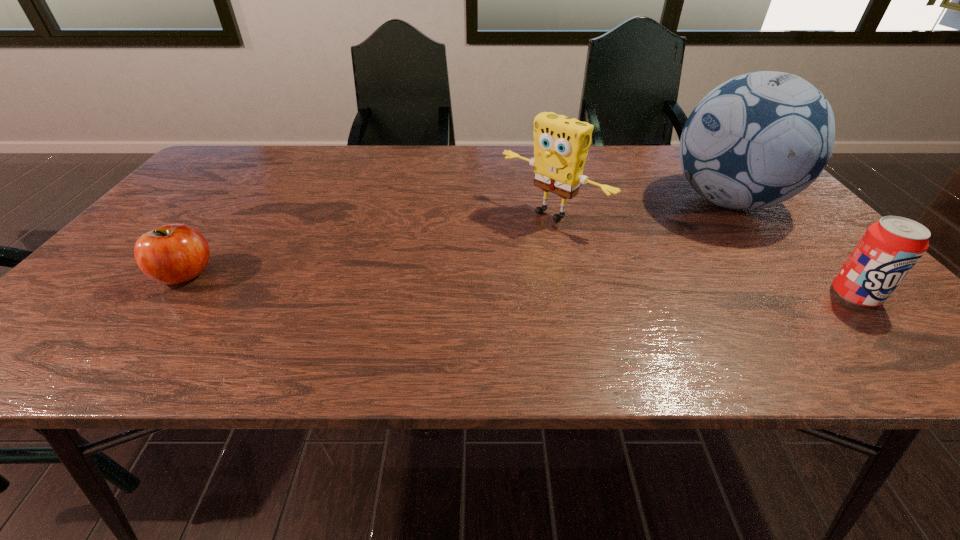
Where is `apple`? This screenshot has height=540, width=960. apple is located at coordinates (172, 254).

Find the location of a particular element. the leftmost object is located at coordinates (172, 254).

At what (x,y) coordinates should I click in order to perform the action: click on soda can. Please return your answer as a coordinate pair (x, y). This screenshot has height=540, width=960. Looking at the image, I should click on (889, 249).

Locate an element on the screen. Image resolution: width=960 pixels, height=540 pixels. sponge is located at coordinates (561, 144).

The height and width of the screenshot is (540, 960). I want to click on the second tallest object, so click(x=561, y=144).

Identify the location of soccer ball. The image size is (960, 540). pos(758,139).

The image size is (960, 540). Find the location of `vacant area situated 0.080m on the back of the shortest object`. vacant area situated 0.080m on the back of the shortest object is located at coordinates (215, 236).

Where is `free point located on the face of the third object from right to left`? The image size is (960, 540). free point located on the face of the third object from right to left is located at coordinates (436, 299).

Locate an element on the screen. free space located 0.260m on the face of the third object from right to left is located at coordinates (452, 286).

Find the location of a particular element. The width and height of the screenshot is (960, 540). blank space located 0.070m on the face of the third object from right to left is located at coordinates (506, 245).